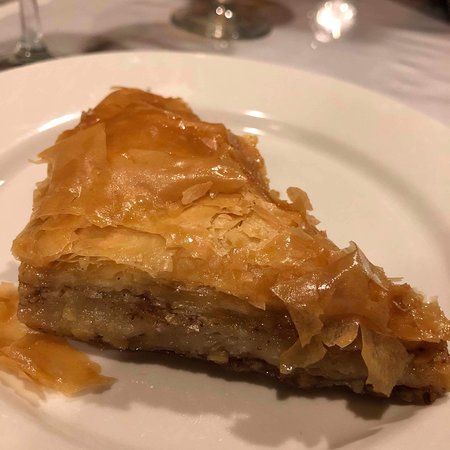
The image size is (450, 450). What are the coordinates of `stem of glass` in the screenshot? It's located at (36, 51).